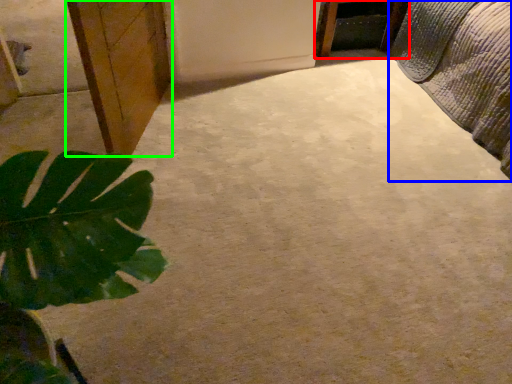
Question: Estimate the real-world distances between objects in this image. Which object is closer to furniture (highlighted by a red box), bed (highlighted by a blue box) or cabinetry (highlighted by a green box)?

Choices:
 (A) bed
 (B) cabinetry

Answer: (A)